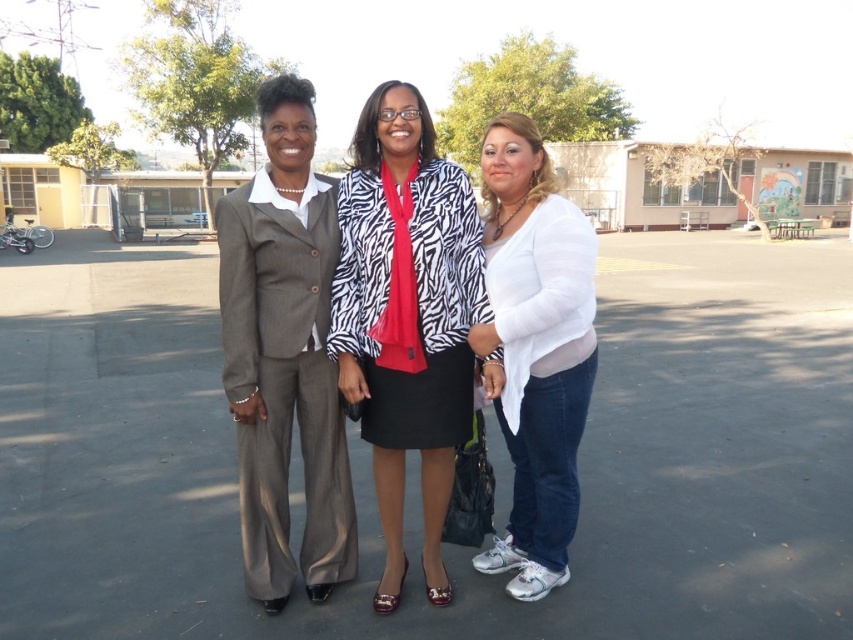
You are standing in a schoolyard and want to cross to the playground structure in the background. The black asphalt parking lot at center is between you and the playground. Is the parking lot close enough for you to step onto and reach the playground without difficulty?

The black asphalt parking lot at center is 9.24 feet away from viewer, which is a reasonable distance to step onto and reach the playground without difficulty.